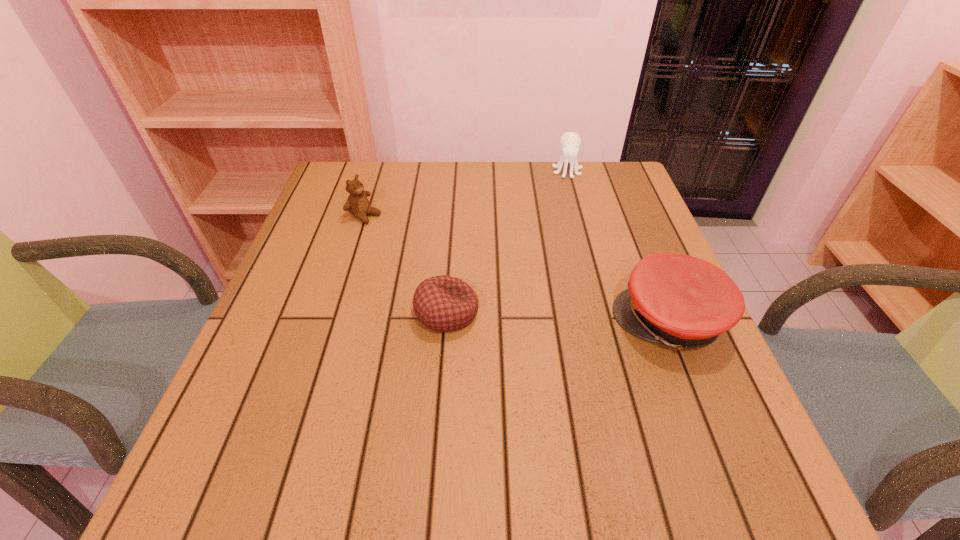
The width and height of the screenshot is (960, 540). I want to click on object identified as the closest to the cap, so click(x=442, y=303).

Image resolution: width=960 pixels, height=540 pixels. I want to click on vacant region that satisfies the following two spatial constraints: 1. on the front side of the shortest object; 2. on the front of the cap with an emblem, so click(x=446, y=321).

You are a GUI agent. You are given a task and a screenshot of the screen. Output one action in this format:
    pyautogui.click(x=<x>, y=<y>)
    Task: Click on the free space that satisfies the following two spatial constraints: 1. on the front side of the cap; 2. on the front of the beanbag with an emblem
    The image size is (960, 540).
    Given the screenshot: What is the action you would take?
    pyautogui.click(x=446, y=321)